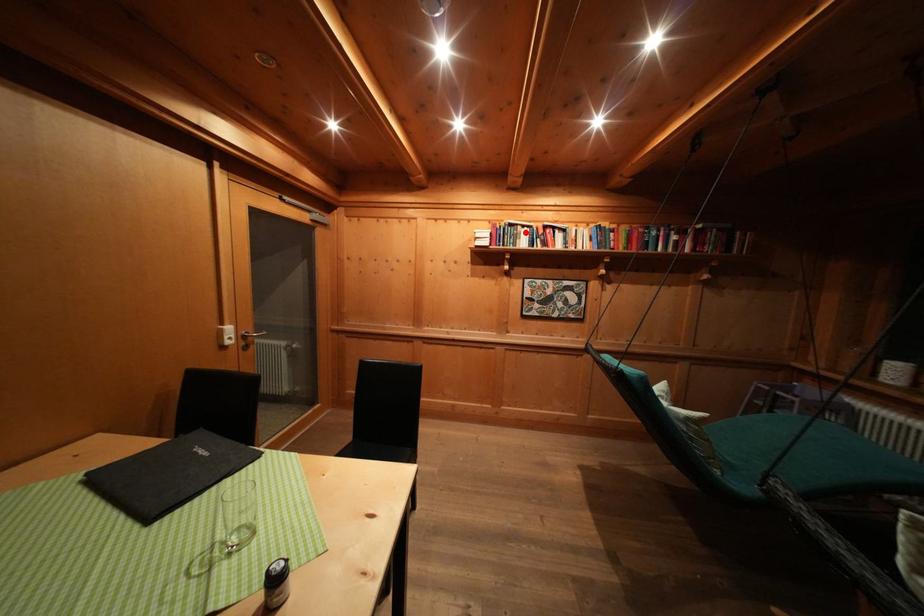
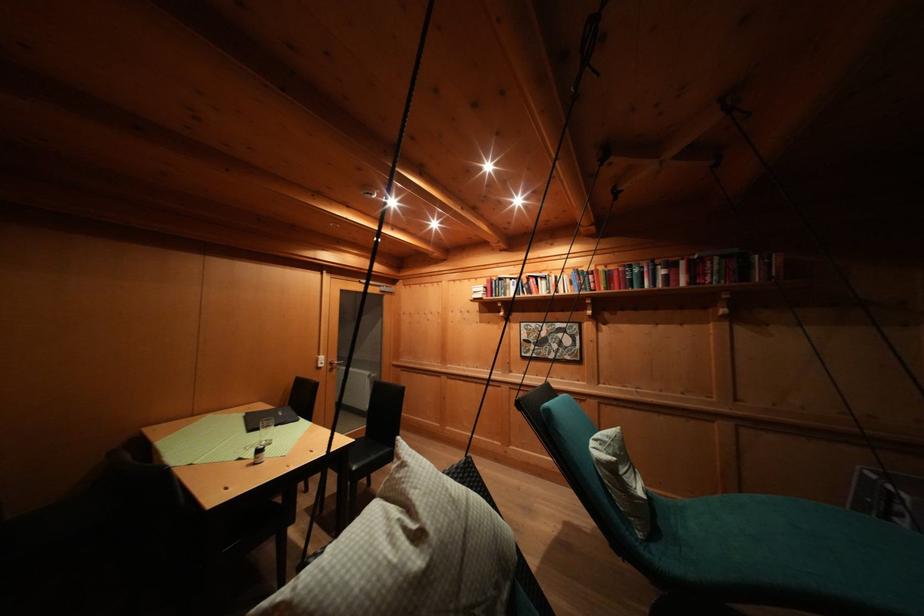
Where in the second image is the point corresponding to the highlighted location from the first image?

(514, 285)